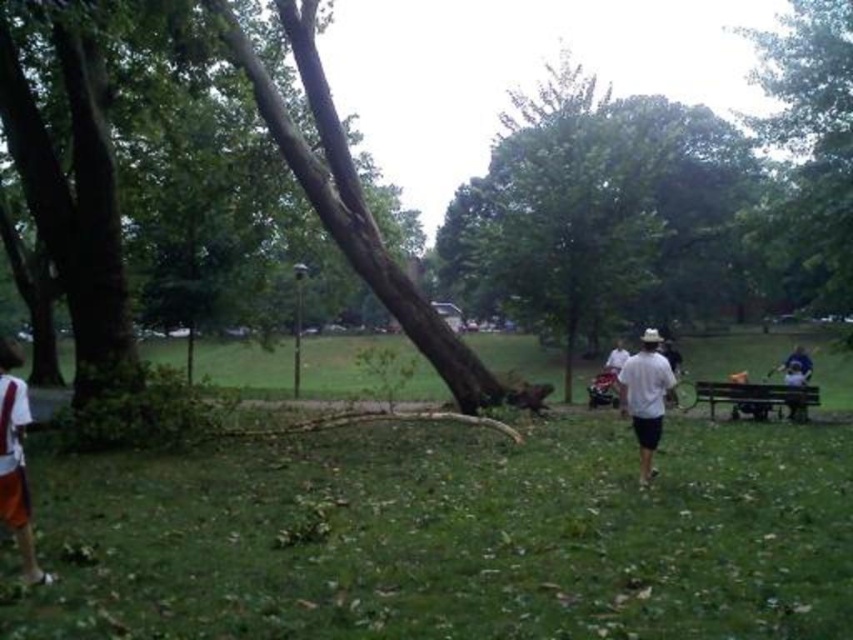
Question: Which of these objects is positioned farthest from the brown rough bark tree at center?

Choices:
 (A) green grassy field at center
 (B) white matte shirt at center
 (C) orange shorts at left
 (D) wooden picnic table at lower right

Answer: (C)

Question: Is brown rough bark tree at center to the right of white matte shirt at center from the viewer's perspective?

Choices:
 (A) yes
 (B) no

Answer: (A)

Question: Considering the real-world distances, which object is closest to the orange shorts at left?

Choices:
 (A) wooden picnic table at lower right
 (B) brown rough bark tree at center
 (C) green leafy tree at upper right

Answer: (A)

Question: Estimate the real-world distances between objects in this image. Which object is farther from the wooden picnic table at lower right?

Choices:
 (A) green leafy tree at upper right
 (B) orange shorts at left

Answer: (B)

Question: Is brown rough bark tree at center bigger than green leafy tree at upper right?

Choices:
 (A) no
 (B) yes

Answer: (A)

Question: Is brown rough bark tree at center further to the viewer compared to green grassy field at center?

Choices:
 (A) yes
 (B) no

Answer: (A)